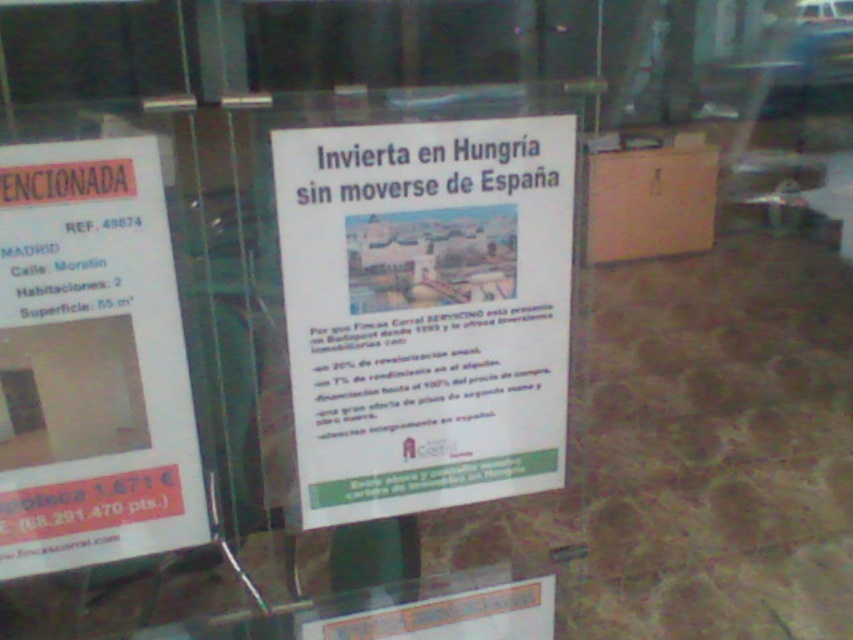
Looking at this image, you are a customer looking at two white paper posters displayed in a real estate office window. You want to read the one on the right side first. Which poster should you look at first, the white paper poster at center or the white paper poster at left?

The white paper poster at center is positioned on the right side of the white paper poster at left. Therefore, to read the one on the right side first, you should look at the white paper poster at center first.

You are a window cleaner with a 10 inch wide equipment. You need to clean the window where the white paper poster at center and the white paper poster at left are displayed. Can your equipment fit between them without touching either poster?

The distance between the white paper poster at center and the white paper poster at left is 9.70 inches. Since your equipment is 10 inches wide, it cannot fit between them as the space is slightly narrower than the equipment.